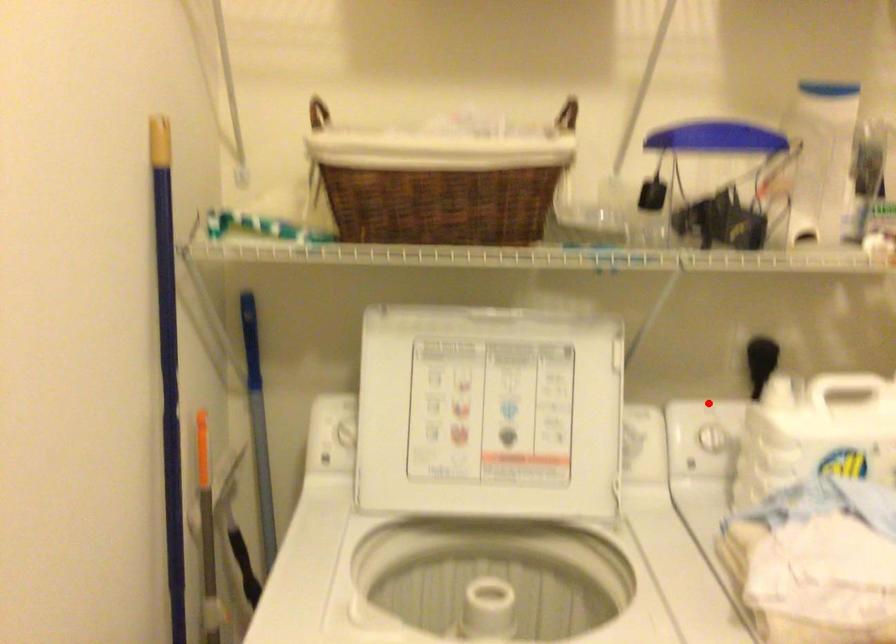
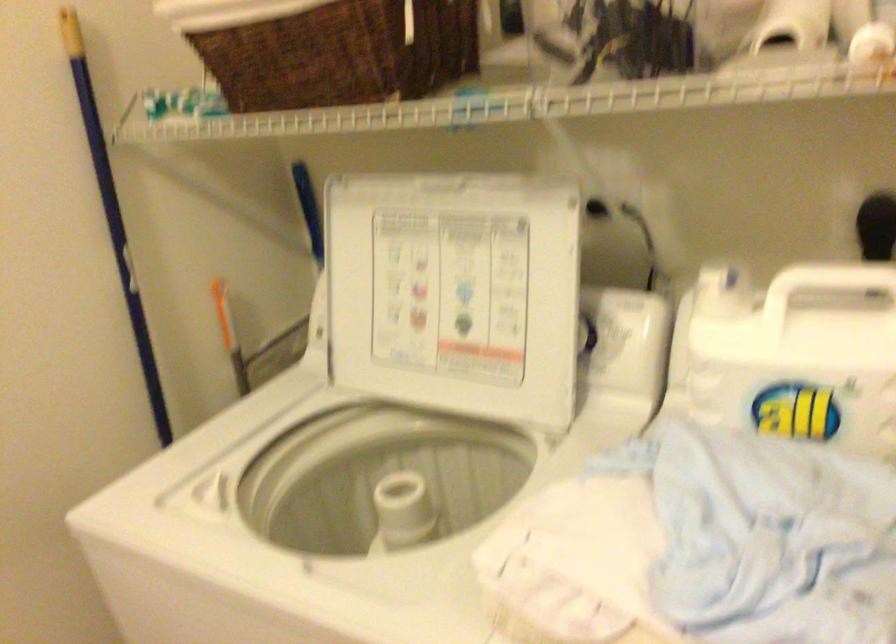
The point at the highlighted location is marked in the first image. Where is the corresponding point in the second image?

(804, 288)